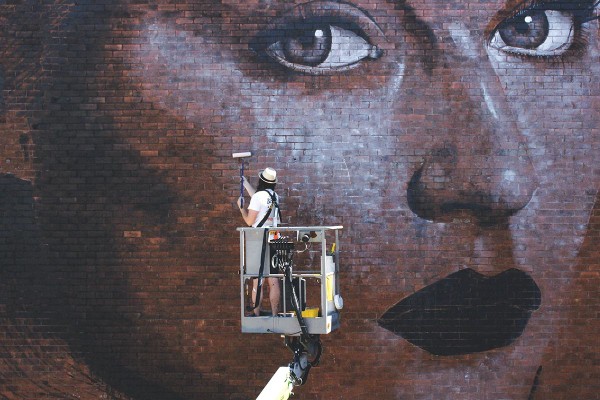
The width and height of the screenshot is (600, 400). Find the location of `paint roller`. paint roller is located at coordinates (236, 154).